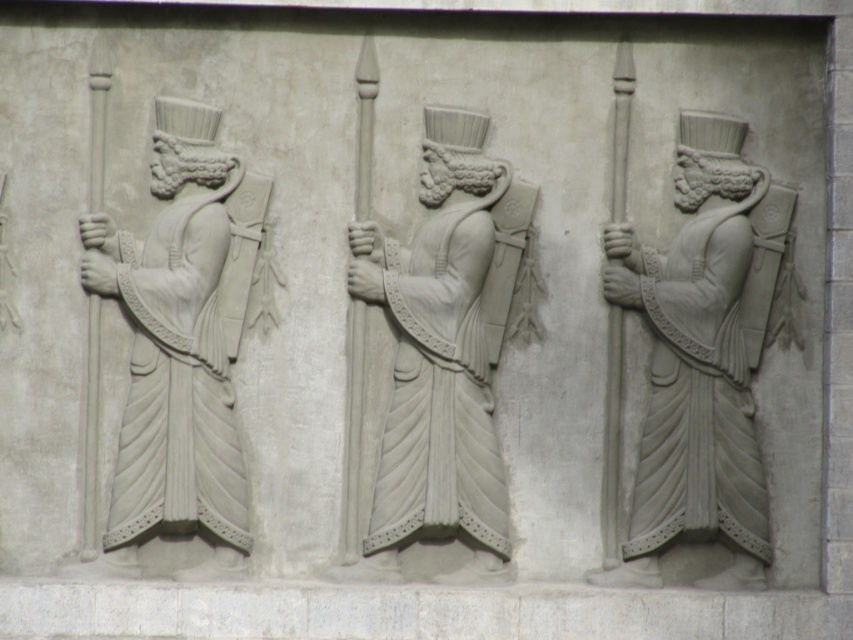
You are an art conservator examining a stone relief sculpture. You notice two figures, the white stone figure at center and the white stone figure at left. Based on their size, which one might be more prominent in the composition?

The white stone figure at center is bigger than the white stone figure at left, making it more prominent in the composition.

You are an archaeologist examining the stone relief sculpture. You notice two figures, the white stone warrior at right and the white stone figure at left. Which one is positioned lower in the relief?

The white stone warrior at right is below the white stone figure at left, so the white stone warrior at right is positioned lower in the relief.

You are an archaeologist examining a stone relief sculpture. You notice two points on the sculpture at coordinates point (515, 230) and point (161, 160). Which point is closer to the surface of the sculpture?

Point (515, 230) is further to the camera than point (161, 160), so the point closer to the surface is point (161, 160).